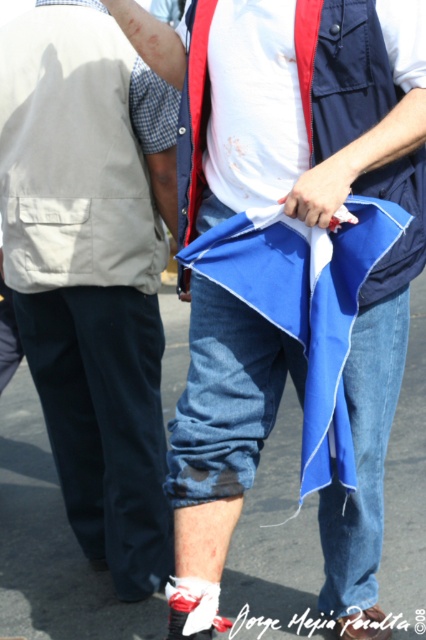
From the picture: Is matte khaki vest at left smaller than blue fabric flag at lower center?

No.

Which is below, matte khaki vest at left or blue fabric flag at lower center?

blue fabric flag at lower center

Does point (129, 301) come closer to viewer compared to point (215, 256)?

No, it is not.

You are a GUI agent. You are given a task and a screenshot of the screen. Output one action in this format:
    pyautogui.click(x=<x>, y=<y>)
    Task: Click on the matte khaki vest at left
    The height and width of the screenshot is (640, 426).
    Given the screenshot: What is the action you would take?
    pyautogui.click(x=92, y=269)

Does matte khaki vest at left have a smaller size compared to dark blue denim jeans at lower center?

No, matte khaki vest at left is not smaller than dark blue denim jeans at lower center.

Which is in front, point (143, 556) or point (152, 428)?

Point (143, 556)

You are a GUI agent. You are given a task and a screenshot of the screen. Output one action in this format:
    pyautogui.click(x=<x>, y=<y>)
    Task: Click on the matte khaki vest at left
    This screenshot has height=640, width=426.
    Given the screenshot: What is the action you would take?
    pyautogui.click(x=92, y=269)

The width and height of the screenshot is (426, 640). Identify the location of matte khaki vest at left. (92, 269).

Is blue fabric flag at lower center behind dark blue denim jeans at lower center?

No, blue fabric flag at lower center is in front of dark blue denim jeans at lower center.

Which is behind, point (187, 465) or point (58, 387)?

Positioned behind is point (58, 387).

Image resolution: width=426 pixels, height=640 pixels. What do you see at coordinates (302, 300) in the screenshot?
I see `blue fabric flag at lower center` at bounding box center [302, 300].

Where is `blue fabric flag at lower center`? Image resolution: width=426 pixels, height=640 pixels. blue fabric flag at lower center is located at coordinates (302, 300).